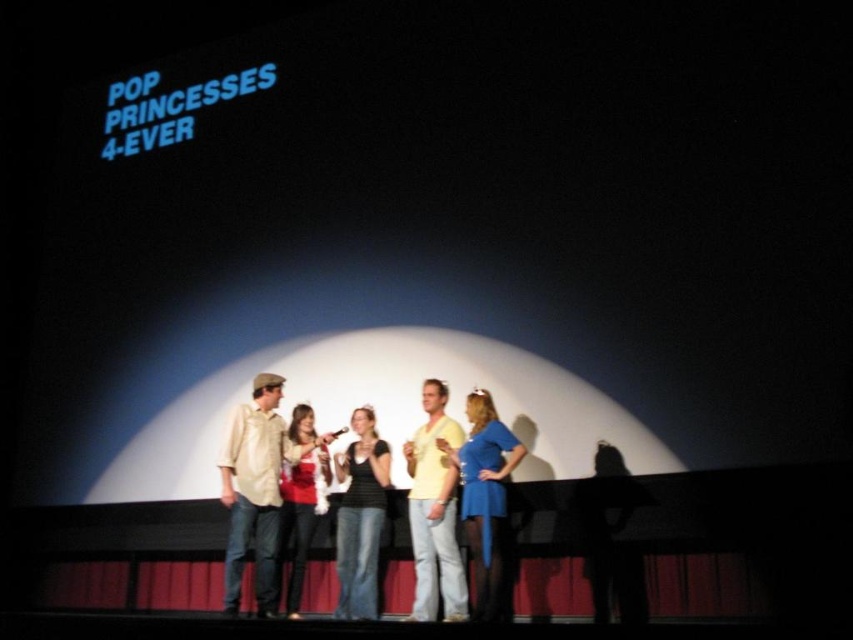
Question: Which object is closer to the camera taking this photo?

Choices:
 (A) matte red dress at center
 (B) black matte tank top at center
 (C) silhouette dress at right
 (D) matte blue dress at center

Answer: (D)

Question: Which point is farther to the camera?

Choices:
 (A) light brown cotton shirt at center
 (B) matte blue dress at center

Answer: (A)

Question: Which of these objects is positioned closest to the matte blue dress at center?

Choices:
 (A) black matte tank top at center
 (B) light brown cotton shirt at center

Answer: (A)

Question: Is light brown cotton shirt at center bigger than matte blue dress at center?

Choices:
 (A) no
 (B) yes

Answer: (A)

Question: Is matte blue dress at center closer to camera compared to black matte tank top at center?

Choices:
 (A) yes
 (B) no

Answer: (A)

Question: In this image, where is yellow matte shirt at center located relative to matte blue dress at center?

Choices:
 (A) right
 (B) left

Answer: (B)